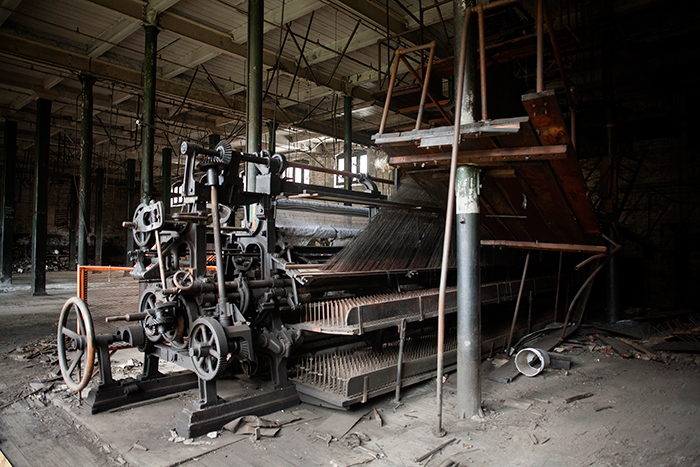
Where is `back wall`? The image size is (700, 467). back wall is located at coordinates (52, 234).